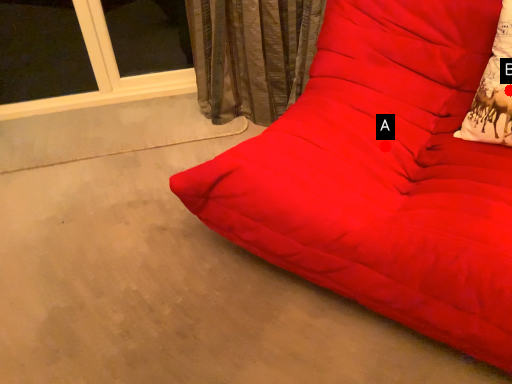
Question: Two points are circled on the image, labeled by A and B beside each circle. Which point appears closest to the camera in this image?

Choices:
 (A) A is closer
 (B) B is closer

Answer: (B)